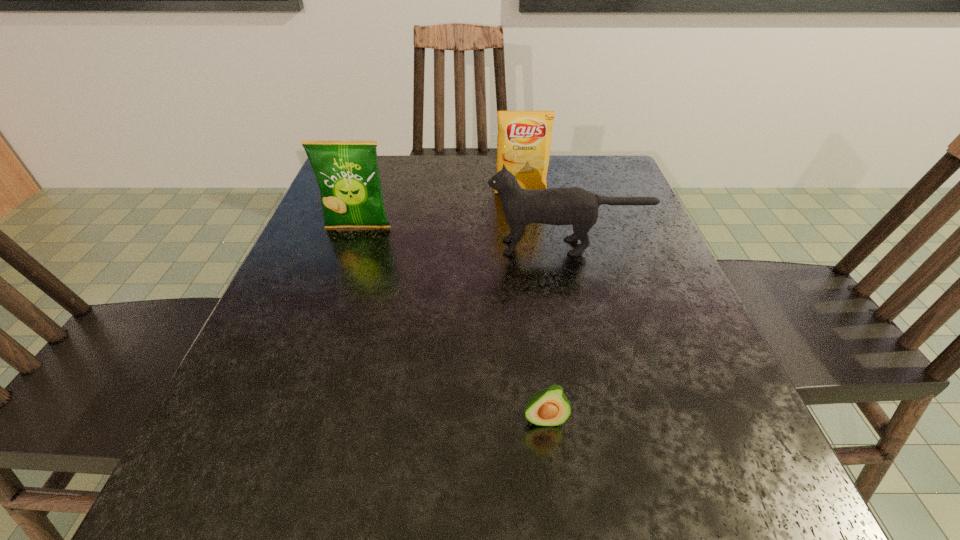
Locate an element on the screen. the farther crisp (potato chip) is located at coordinates (524, 139).

Where is `the right crisp (potato chip)`? Image resolution: width=960 pixels, height=540 pixels. the right crisp (potato chip) is located at coordinates (524, 139).

At what (x,y) coordinates should I click in order to perform the action: click on the left crisp (potato chip). Please return your answer as a coordinate pair (x, y). Looking at the image, I should click on (347, 173).

Locate an element on the screen. This screenshot has height=540, width=960. the nearer crisp (potato chip) is located at coordinates point(347,173).

Locate an element on the screen. This screenshot has height=540, width=960. cat is located at coordinates (575, 206).

Identify the location of the nearest object. (548, 407).

Identify the location of the shortest object. This screenshot has width=960, height=540. click(548, 407).

Locate an element on the screen. free point located on the front of the farther crisp (potato chip) with the logo is located at coordinates (533, 288).

Where is `free space located 0.350m on the front-facing side of the left crisp (potato chip)`? free space located 0.350m on the front-facing side of the left crisp (potato chip) is located at coordinates (308, 371).

Locate an element on the screen. vacant space located on the front-facing side of the second nearest object is located at coordinates (433, 247).